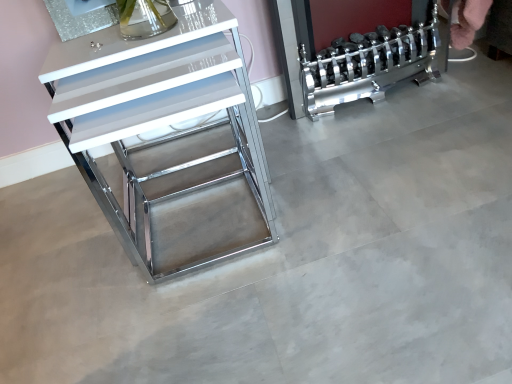
The height and width of the screenshot is (384, 512). I want to click on free spot below chrome metallic dumbbell rack at right (from a real-world perspective), so click(374, 92).